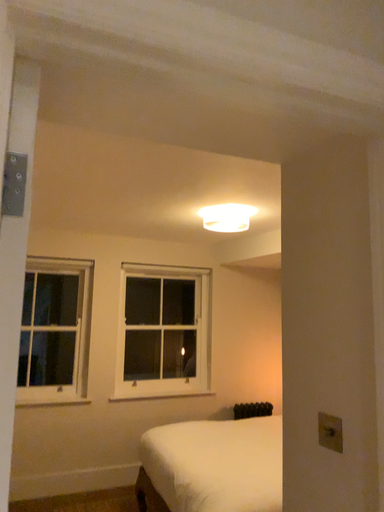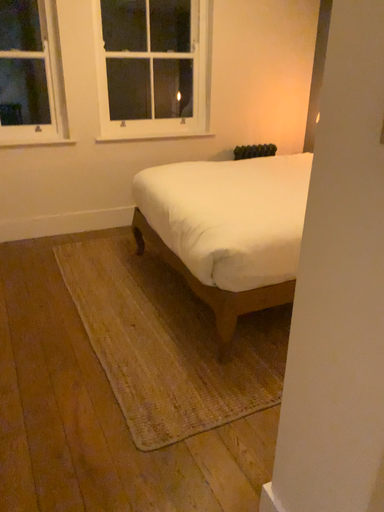
Question: How did the camera likely rotate when shooting the video?

Choices:
 (A) rotated upward
 (B) rotated downward

Answer: (B)